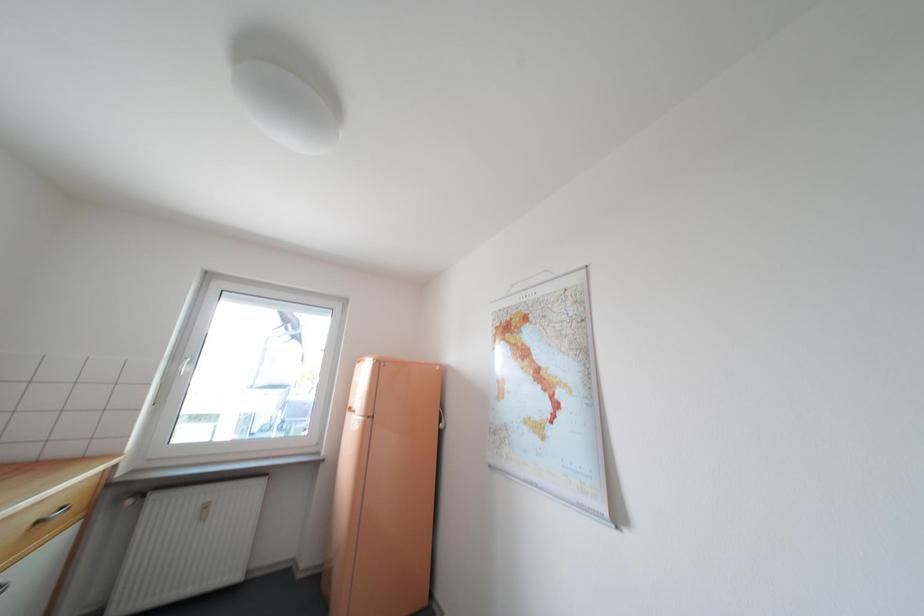
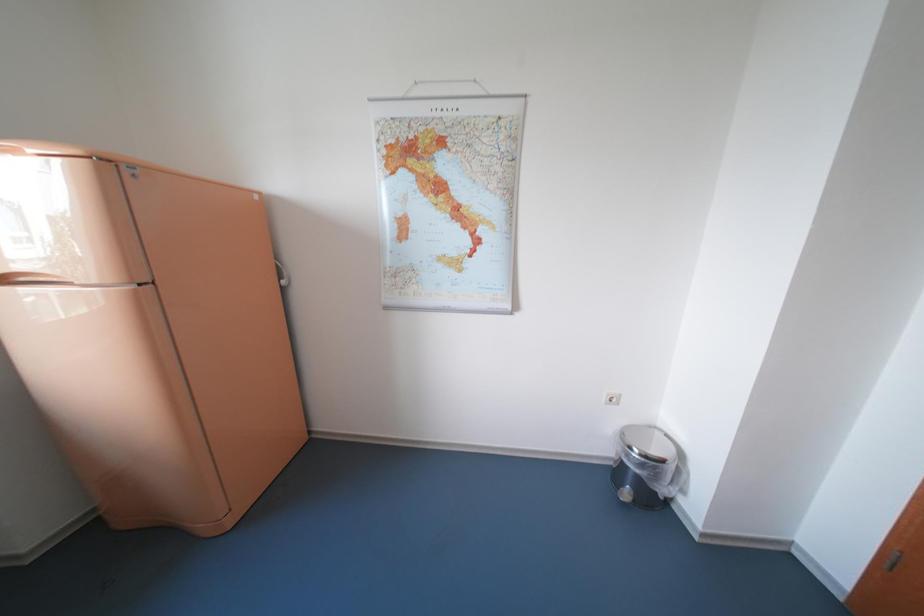
The first image is from the beginning of the video and the second image is from the end. How did the camera likely rotate when shooting the video?

The camera rotated toward right-down.